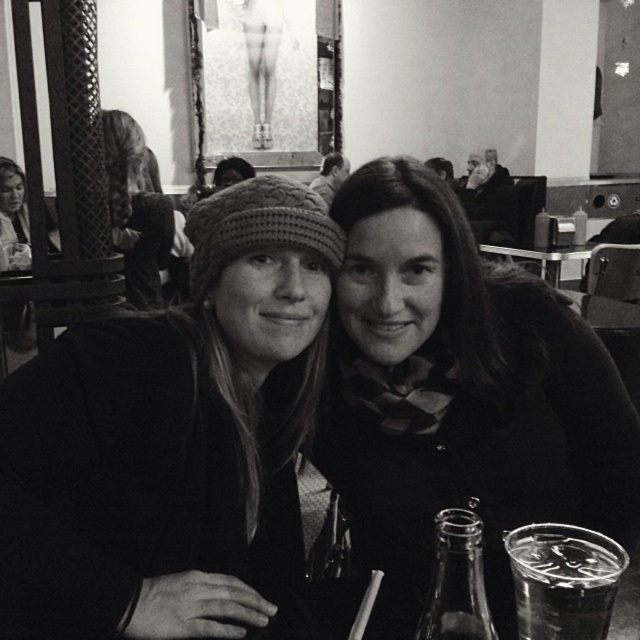
Question: Which object is positioned closest to the clear glass at lower right?

Choices:
 (A) transparent glass bottle at lower center
 (B) knitted wool hat at center

Answer: (A)

Question: Considering the relative positions of matte black scarf at center and smooth black jacket at upper right in the image provided, where is matte black scarf at center located with respect to smooth black jacket at upper right?

Choices:
 (A) above
 (B) below

Answer: (B)

Question: From the image, what is the correct spatial relationship of clear glass at lower right in relation to transparent glass bottle at lower center?

Choices:
 (A) above
 (B) below

Answer: (B)

Question: Is transparent glass bottle at lower center above smooth black jacket at upper right?

Choices:
 (A) no
 (B) yes

Answer: (A)

Question: Which point is farther to the camera?

Choices:
 (A) (324, 182)
 (B) (150, 208)
 (C) (237, 285)

Answer: (A)

Question: Which of the following is the closest to the observer?

Choices:
 (A) clear glass at lower right
 (B) knitted wool hat at upper left

Answer: (A)